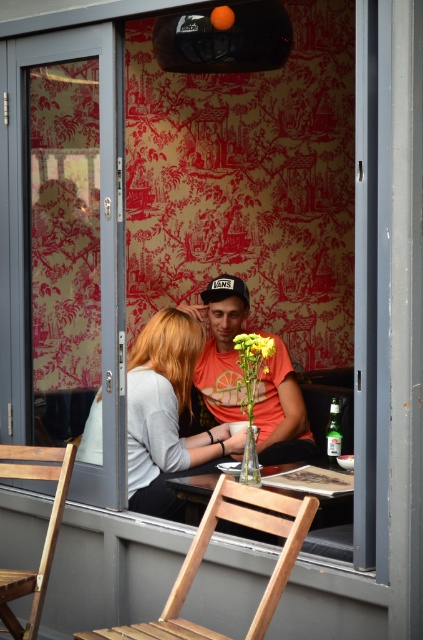
You are standing in the room and want to move from the wooden chair at lower left to the light brown wooden chair at lower center. Which direction should you move to reach it?

The light brown wooden chair at lower center is located below the wooden chair at lower left, so you should move downward to reach it.

You are a tailor who needs to place a new decorative pin between the orange matte shirt at center and the black fabric baseball cap at center. The pin requires 16 inches of space to be safely placed without touching either item. Based on the scene, is there enough space between them?

The orange matte shirt at center and black fabric baseball cap at center are 15.34 inches apart from each other, which is less than the required 16 inches. Therefore, there isn not enough space to safely place the pin without touching either item.